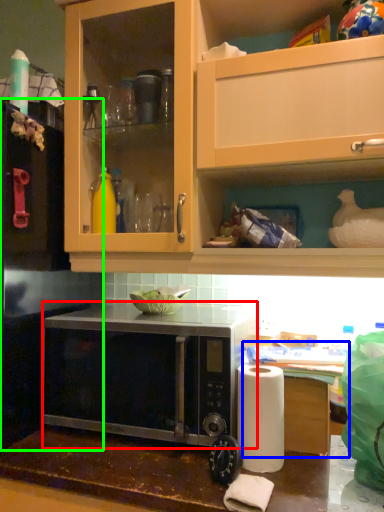
Question: Which is nearer to the microwave oven (highlighted by a red box)? table (highlighted by a blue box) or appliance (highlighted by a green box).

Choices:
 (A) table
 (B) appliance

Answer: (B)